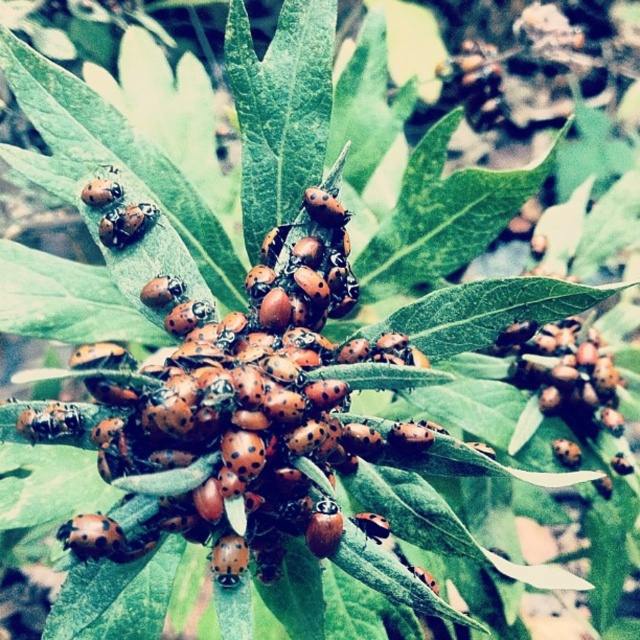
Question: Which point is closer to the camera?

Choices:
 (A) orange matte ladybug at center
 (B) green matte leaf at upper right

Answer: (B)

Question: Is green matte leaf at upper right closer to the viewer compared to orange matte ladybug at center?

Choices:
 (A) yes
 (B) no

Answer: (A)

Question: Is green matte leaf at upper right thinner than orange matte ladybug at center?

Choices:
 (A) no
 (B) yes

Answer: (A)

Question: Which of the following is the closest to the observer?

Choices:
 (A) orange matte ladybug at center
 (B) green matte leaf at upper right

Answer: (B)

Question: Is green matte leaf at upper right below orange matte ladybug at center?

Choices:
 (A) no
 (B) yes

Answer: (B)